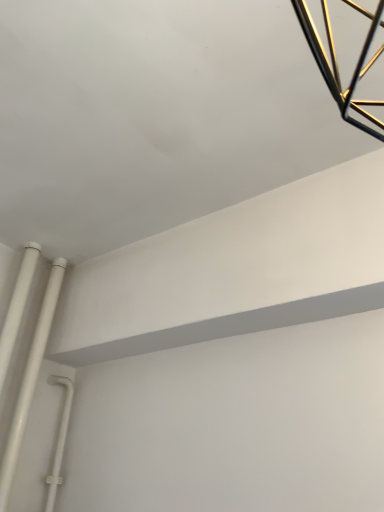
What is the approximate height of white glossy pipes at left?

The height of white glossy pipes at left is 29.01 inches.

Image resolution: width=384 pixels, height=512 pixels. Describe the element at coordinates (30, 380) in the screenshot. I see `white glossy pipes at left` at that location.

Where is `white glossy pipes at left`? Image resolution: width=384 pixels, height=512 pixels. white glossy pipes at left is located at coordinates (30, 380).

Where is `white glossy pipes at left`? white glossy pipes at left is located at coordinates (30, 380).